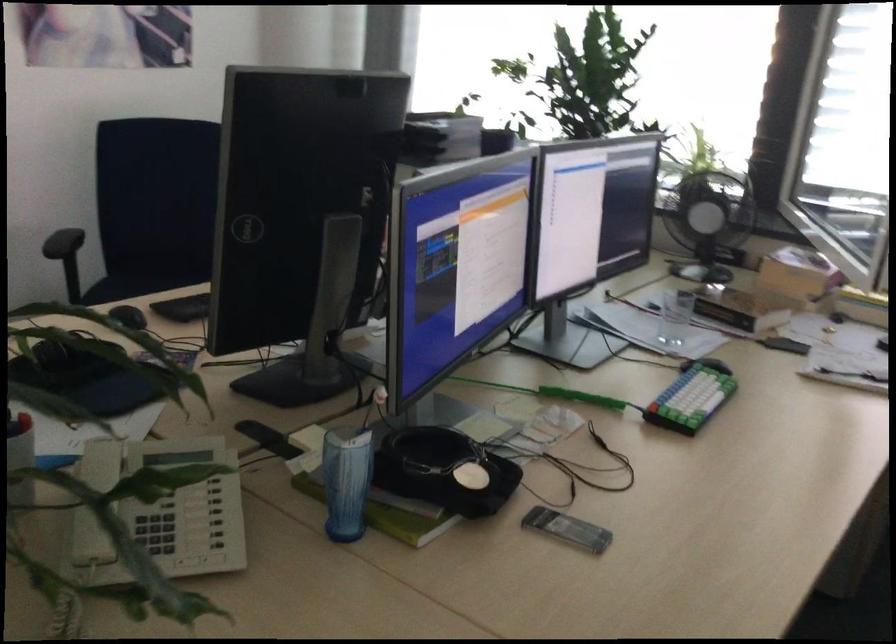
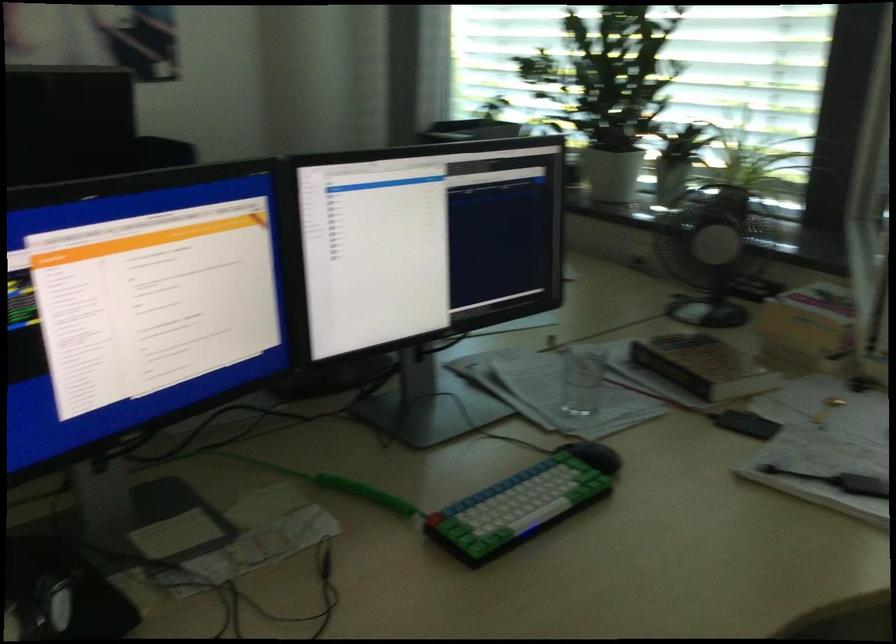
The point at (702, 393) is marked in the first image. Where is the corresponding point in the second image?

(523, 503)